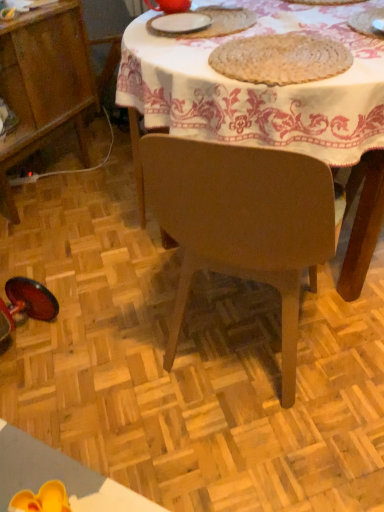
The image size is (384, 512). Identify the location of free space on the front side of white matte plate at upper center, the 2th tableware in the left-to-right sequence. (193, 42).